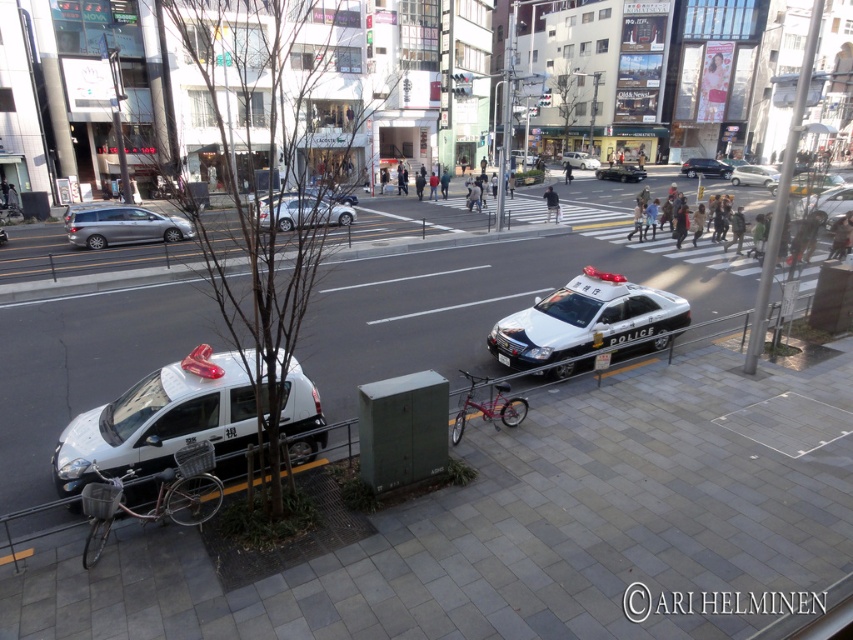
Describe the element at coordinates (514, 528) in the screenshot. Image resolution: width=853 pixels, height=640 pixels. I see `gray concrete pavement at center` at that location.

Can you confirm if gray concrete pavement at center is wider than satin silver van at left?

Correct, the width of gray concrete pavement at center exceeds that of satin silver van at left.

Who is more forward, (653, 416) or (154, 227)?

Point (653, 416)

Locate an element on the screen. The width and height of the screenshot is (853, 640). gray concrete pavement at center is located at coordinates (514, 528).

Who is lower down, white glossy police car at lower left or white glossy sedan at upper center?

Positioned lower is white glossy police car at lower left.

Does white glossy police car at lower left appear on the right side of white glossy sedan at upper center?

Incorrect, white glossy police car at lower left is not on the right side of white glossy sedan at upper center.

Does point (227, 381) come closer to viewer compared to point (582, 156)?

Yes, it is in front of point (582, 156).

I want to click on white glossy police car at lower left, so click(160, 419).

Is white glossy police car at center wider than matte black sedan at center?

No, white glossy police car at center is not wider than matte black sedan at center.

Between point (573, 316) and point (706, 161), which one is positioned in front?

Point (573, 316)

Where is `white glossy police car at center`? white glossy police car at center is located at coordinates (584, 320).